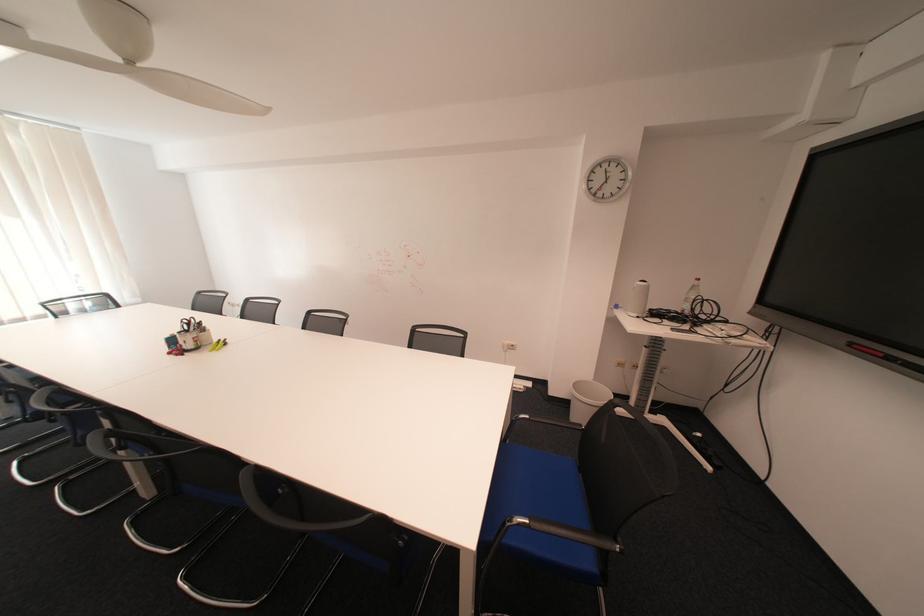
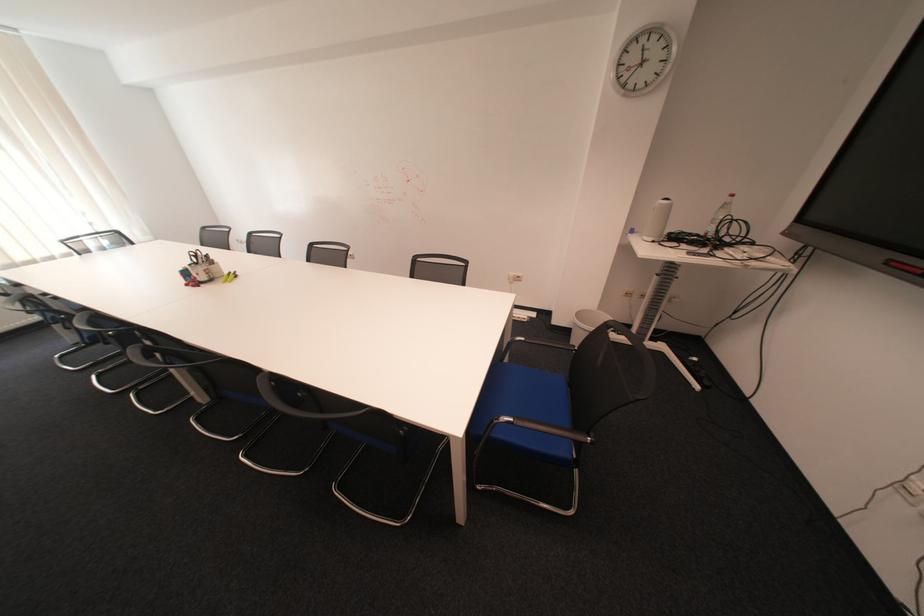
Question: How did the camera likely rotate?

Choices:
 (A) Left
 (B) Right
 (C) Up
 (D) Down

Answer: (D)